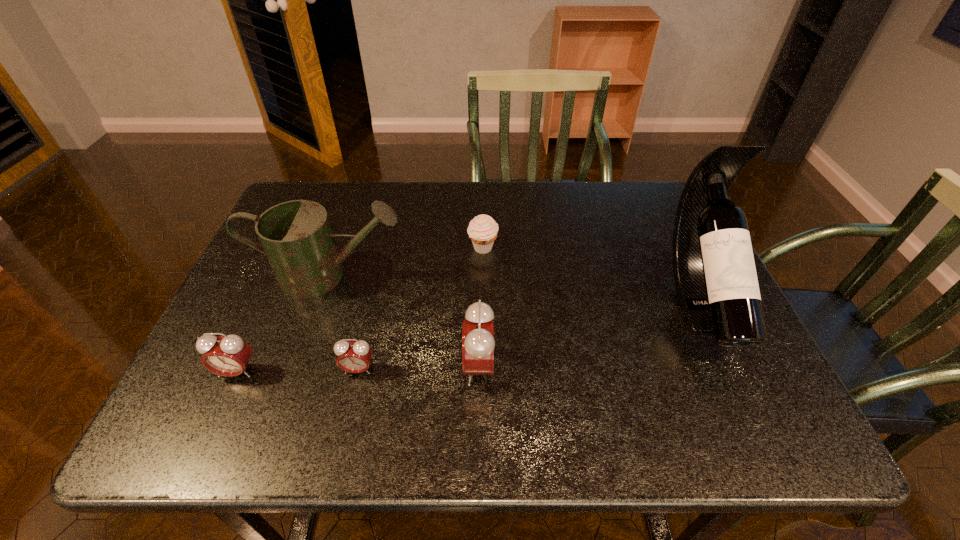
Where is `vacant area situated 0.190m on the clock face of the tallest alarm clock`? vacant area situated 0.190m on the clock face of the tallest alarm clock is located at coordinates (373, 367).

Locate an element on the screen. vacant space positioned 0.100m on the back of the muffin is located at coordinates coord(483,217).

The image size is (960, 540). I want to click on free spot located on the stand of the wine bottle, so click(x=742, y=393).

Identify the location of vacant area located 0.280m with the spout on the watering can. The height and width of the screenshot is (540, 960). (516, 276).

Where is `wine bottle at the near edge`? The width and height of the screenshot is (960, 540). wine bottle at the near edge is located at coordinates (715, 277).

Find the location of a particular element. alarm clock that is at the left edge is located at coordinates (229, 355).

The width and height of the screenshot is (960, 540). Identify the location of watering can positioned at the left edge. (296, 236).

The height and width of the screenshot is (540, 960). What are the coordinates of `object that is at the right edge` in the screenshot? It's located at (715, 277).

Where is `object that is at the near left corner`? object that is at the near left corner is located at coordinates (229, 355).

What are the coordinates of `object that is at the near right corner` in the screenshot? It's located at (715, 277).